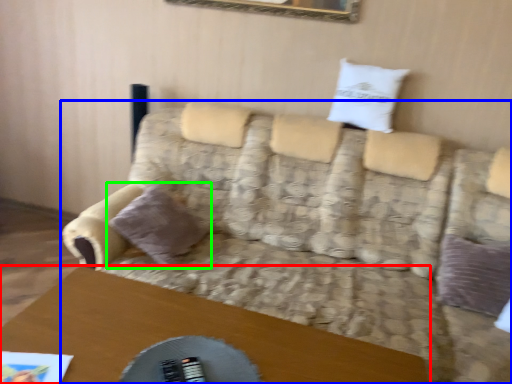
Question: Which object is the farthest from table (highlighted by a red box)? Choose among these: studio couch (highlighted by a blue box) or pillow (highlighted by a green box).

Choices:
 (A) studio couch
 (B) pillow

Answer: (A)